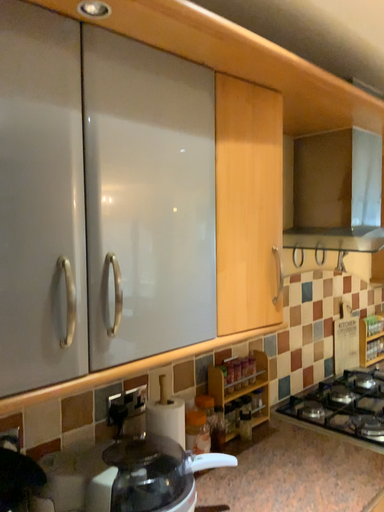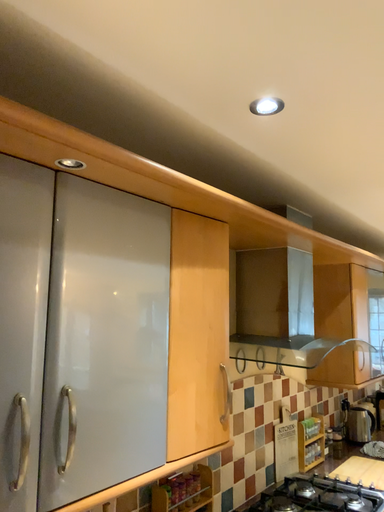
Question: Which way did the camera rotate in the video?

Choices:
 (A) rotated downward
 (B) rotated upward

Answer: (B)